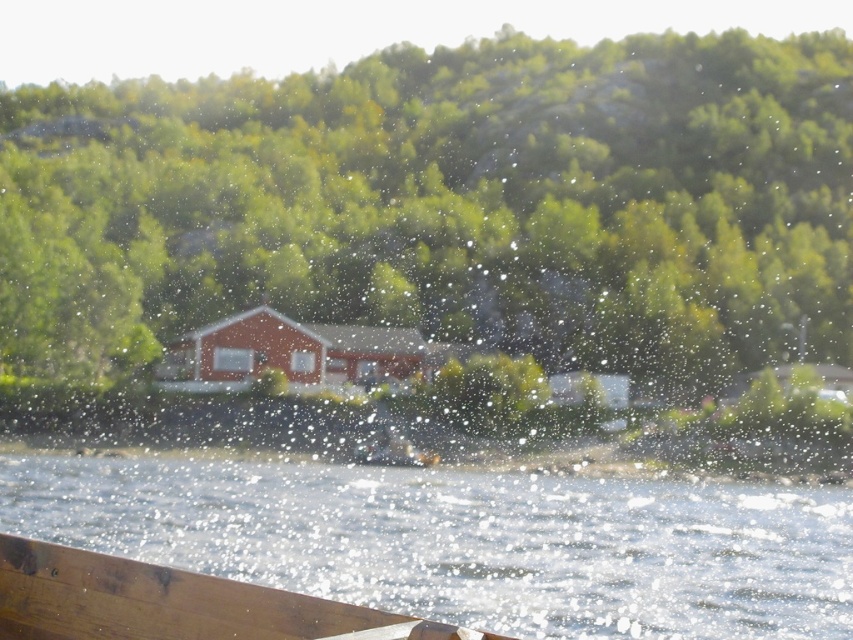
Which is in front, point (408, 547) or point (164, 611)?

Positioned in front is point (164, 611).

Based on the photo, who is lower down, clear water at lower center or wooden boat at lower left?

clear water at lower center is lower down.

Which is behind, point (825, 612) or point (334, 632)?

The point (825, 612) is more distant.

Where is `clear water at lower center`? clear water at lower center is located at coordinates (468, 541).